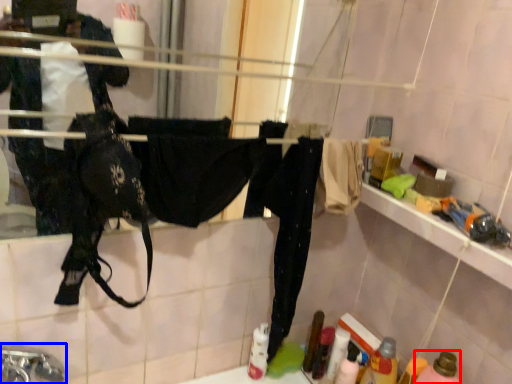
Question: Which point is closer to the camera, bottle (highlighted by a red box) or faucet (highlighted by a blue box)?

Choices:
 (A) bottle
 (B) faucet

Answer: (B)